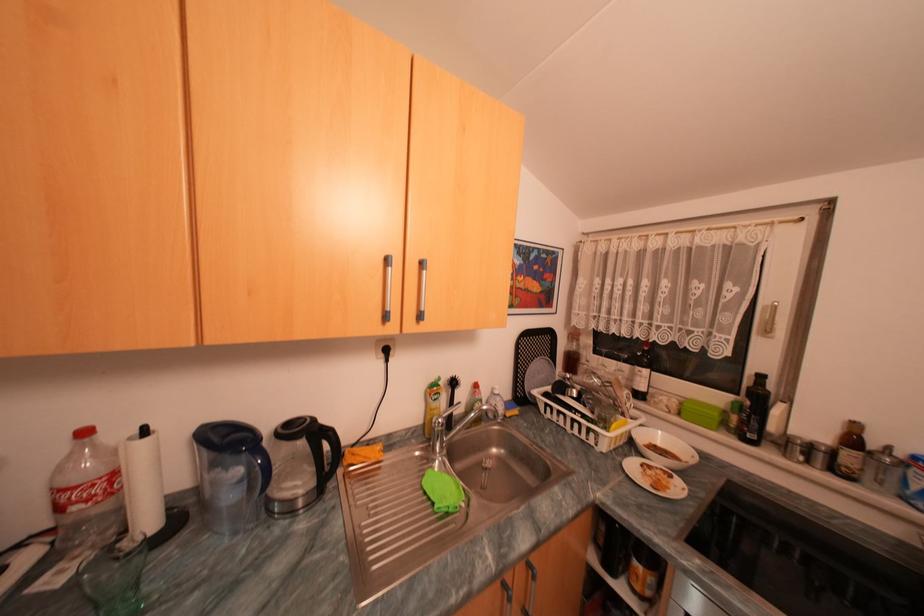
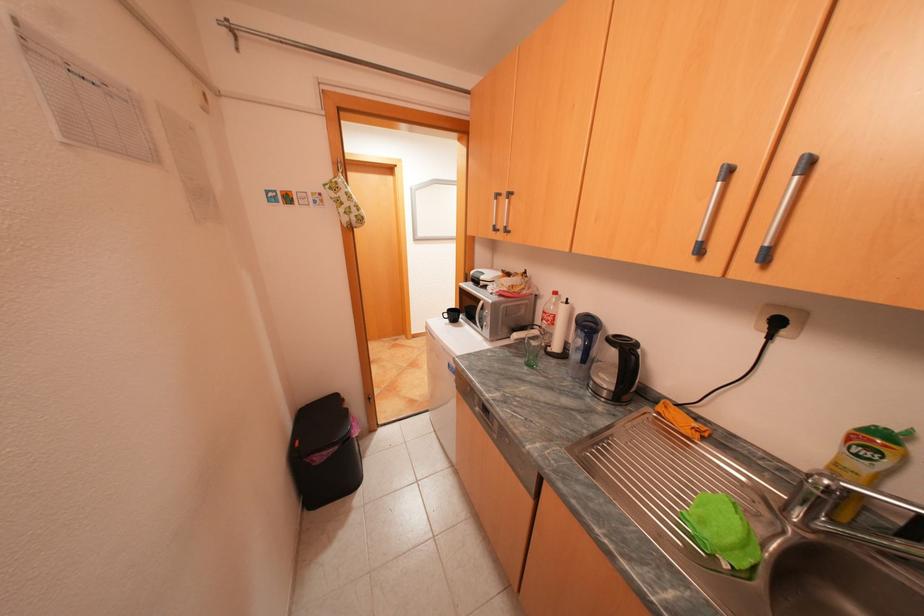
Where in the second image is the point corresponding to point 443,387 from the first image?

(882, 439)